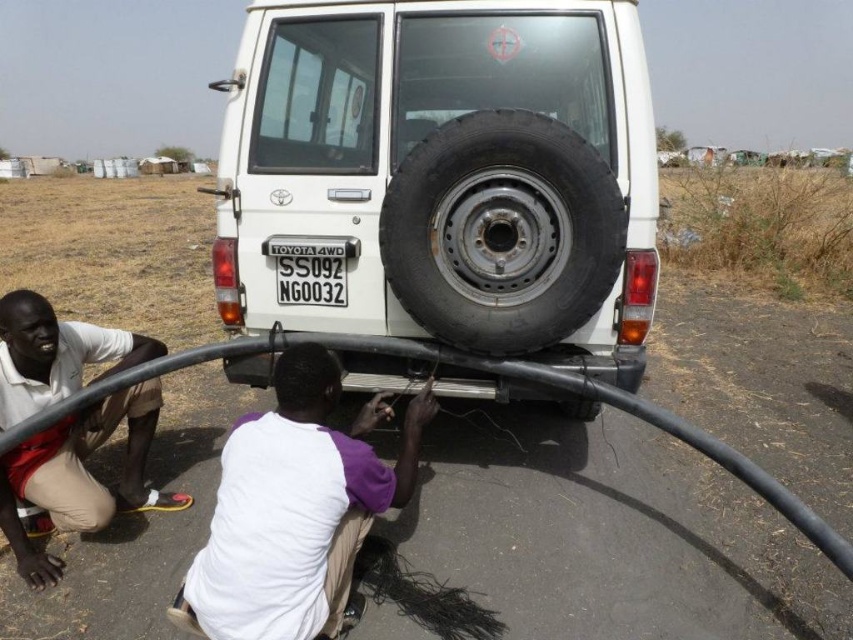
Consider the image. Who is positioned more to the right, light beige shorts at lower left or black plastic license plate at center?

black plastic license plate at center

Which of these two, light beige shorts at lower left or black plastic license plate at center, stands shorter?

black plastic license plate at center is shorter.

Which is behind, point (91, 340) or point (300, 269)?

The point (300, 269) is more distant.

Identify the location of light beige shorts at lower left. (79, 476).

Is brown dry soil at lower left thinner than light beige shorts at lower left?

No.

Who is shorter, brown dry soil at lower left or light beige shorts at lower left?

light beige shorts at lower left

Who is more forward, [579,548] or [0,504]?

Point [0,504] is more forward.

Locate an element on the screen. The image size is (853, 640). brown dry soil at lower left is located at coordinates (608, 532).

Does white fabric squat at center lie in front of black plastic license plate at center?

Yes, white fabric squat at center is closer to the viewer.

Can you confirm if white fabric squat at center is positioned to the right of black plastic license plate at center?

Yes, white fabric squat at center is to the right of black plastic license plate at center.

Where is `white fabric squat at center`? white fabric squat at center is located at coordinates (294, 509).

Locate an element on the screen. Image resolution: width=853 pixels, height=640 pixels. white fabric squat at center is located at coordinates (294, 509).